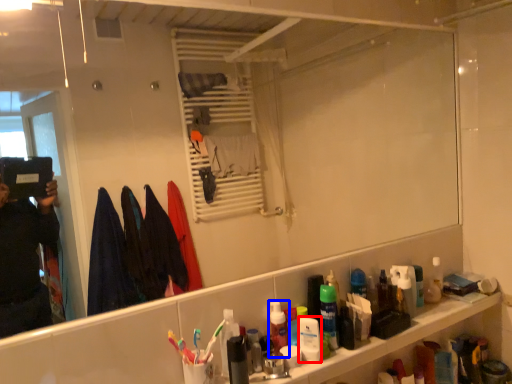
Question: Which object is further to the camera taking this photo, mouthwash (highlighted by a red box) or mouthwash (highlighted by a blue box)?

Choices:
 (A) mouthwash
 (B) mouthwash

Answer: (B)